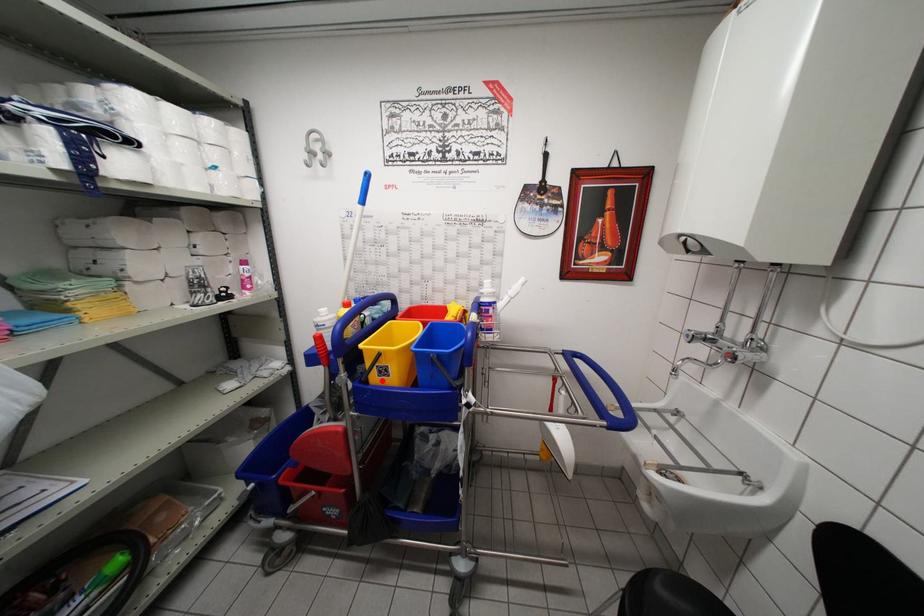
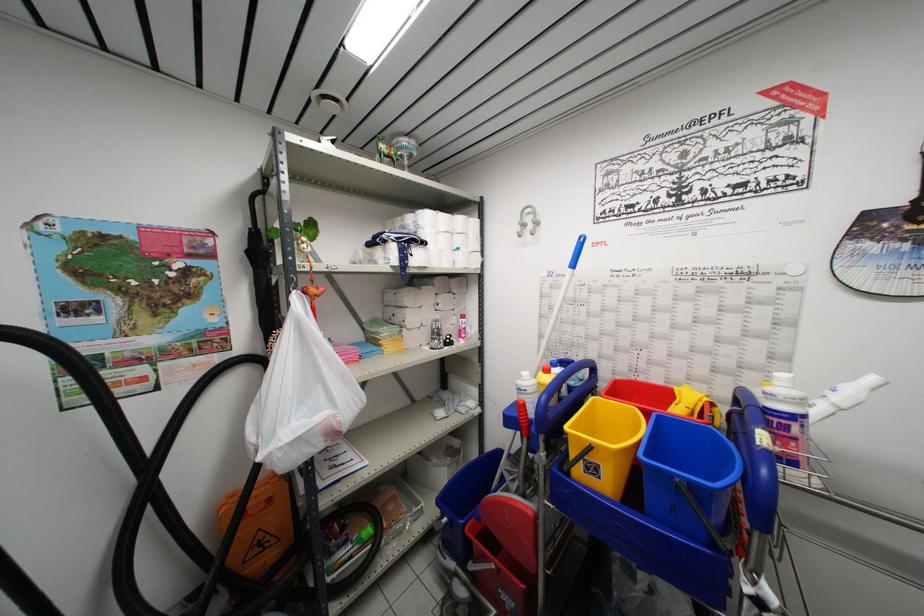
Question: I am providing you with two images of the same scene from different viewpoints. In image1, a red point is highlighted. Considering the same 3D point in image2, which of the following is correct?

Choices:
 (A) It is closer
 (B) It is farther

Answer: (A)